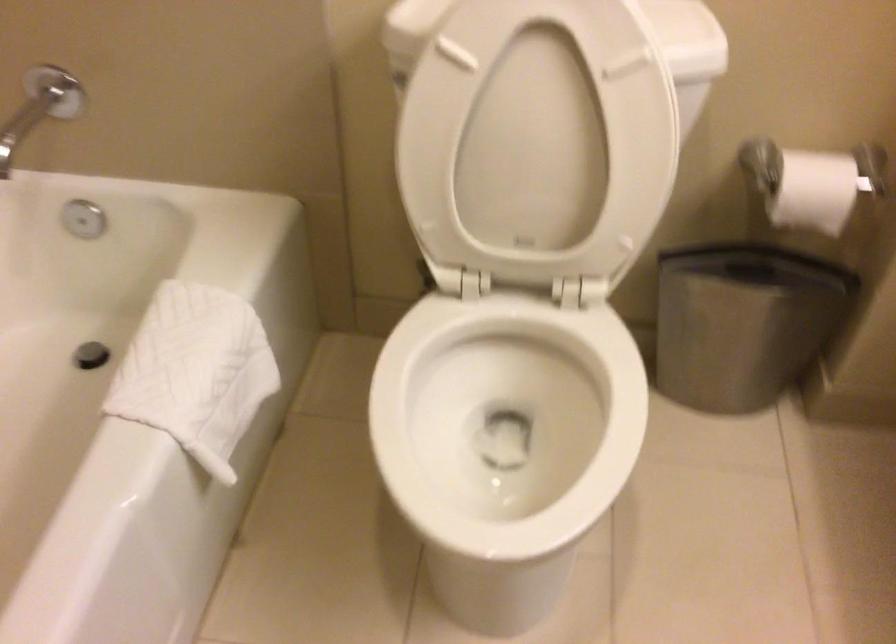
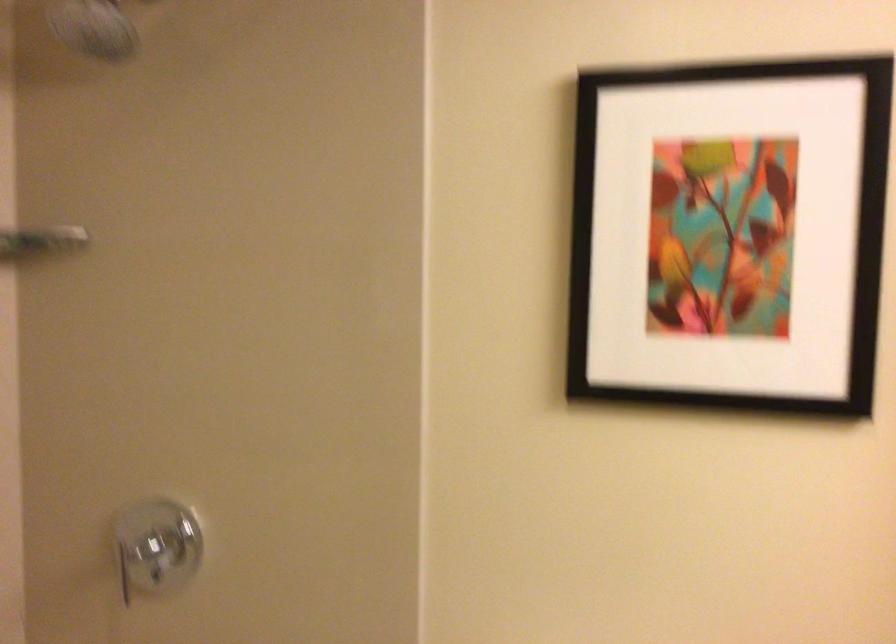
Question: Based on the continuous images, in which direction is the camera rotating? Reply with the corresponding letter.

Choices:
 (A) Left
 (B) Right
 (C) Up
 (D) Down

Answer: (C)